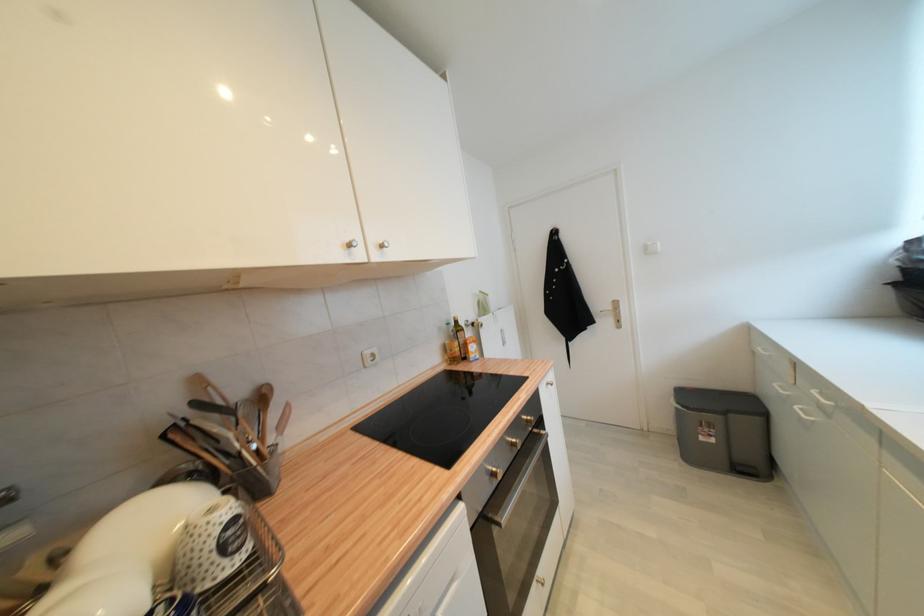
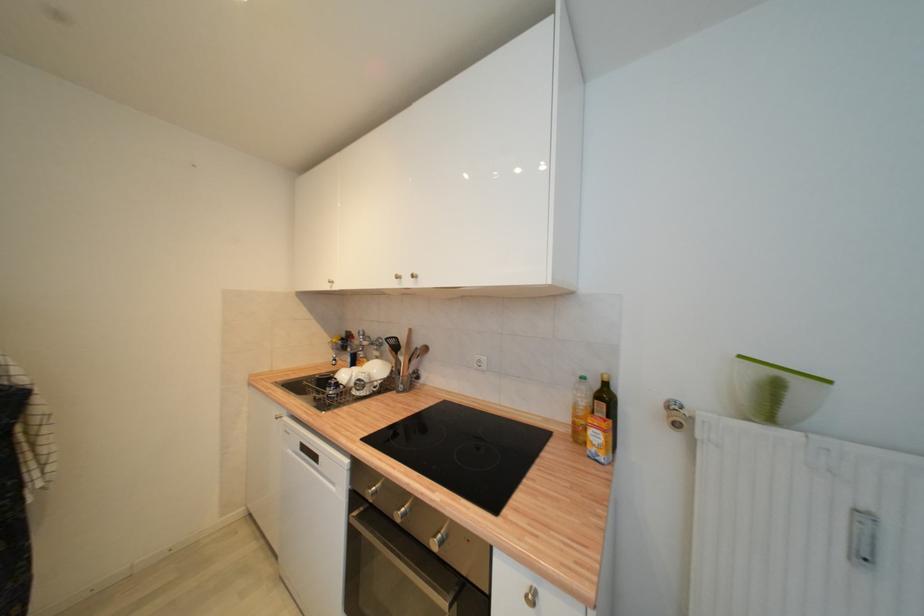
Find the pixel in the second image that matches pixel 508 345 in the first image.

(869, 560)